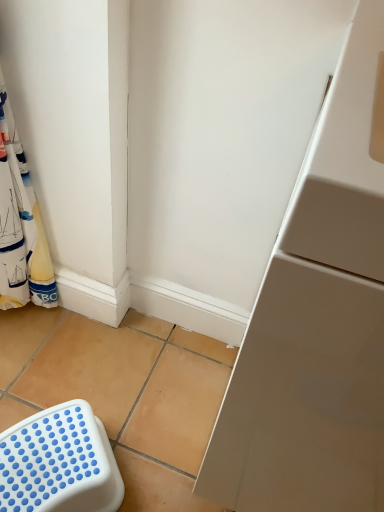
This screenshot has height=512, width=384. Describe the element at coordinates (59, 463) in the screenshot. I see `white plastic stool at lower left` at that location.

Where is `white plastic stool at lower left`? white plastic stool at lower left is located at coordinates (59, 463).

In order to face white fabric laundry at left, should I rotate leftwards or rightwards?

Turn left by 26.587 degrees to look at white fabric laundry at left.

Measure the distance between point (22, 207) and camera.

38.78 inches.

Where is `white fabric laundry at left`? Image resolution: width=384 pixels, height=512 pixels. white fabric laundry at left is located at coordinates (28, 211).

The image size is (384, 512). What do you see at coordinates (28, 211) in the screenshot? I see `white fabric laundry at left` at bounding box center [28, 211].

I want to click on white plastic stool at lower left, so click(x=59, y=463).

Is white fabric laundry at left to the right of white plastic stool at lower left from the viewer's perspective?

In fact, white fabric laundry at left is to the left of white plastic stool at lower left.

Which object is further away from the camera, white fabric laundry at left or white plastic stool at lower left?

white plastic stool at lower left.

Considering the positions of point (5, 122) and point (56, 488), is point (5, 122) closer or farther from the camera than point (56, 488)?

Point (5, 122) is farther from the camera than point (56, 488).

From the image's perspective, would you say white fabric laundry at left is shown under white plastic stool at lower left?

Actually, white fabric laundry at left appears above white plastic stool at lower left in the image.

From a real-world perspective, is white fabric laundry at left on white plastic stool at lower left?

Indeed, from a real-world perspective, white fabric laundry at left stands above white plastic stool at lower left.

Can you confirm if white fabric laundry at left is wider than white plastic stool at lower left?

No, white fabric laundry at left is not wider than white plastic stool at lower left.

Consider the image. Considering the relative sizes of white fabric laundry at left and white plastic stool at lower left in the image provided, is white fabric laundry at left taller than white plastic stool at lower left?

Indeed, white fabric laundry at left has a greater height compared to white plastic stool at lower left.

Who is smaller, white fabric laundry at left or white plastic stool at lower left?

white plastic stool at lower left.

Looking at this image, is white fabric laundry at left inside the boundaries of white plastic stool at lower left, or outside?

white fabric laundry at left exists outside the volume of white plastic stool at lower left.

Is white fabric laundry at left next to white plastic stool at lower left and touching it?

white fabric laundry at left is not next to white plastic stool at lower left, and they're not touching.

Is white fabric laundry at left turned away from white plastic stool at lower left?

No.

What's the angular difference between white fabric laundry at left and white plastic stool at lower left's facing directions?

The angular difference between white fabric laundry at left and white plastic stool at lower left is 28.2 degrees.

Measure the distance between white fabric laundry at left and white plastic stool at lower left.

They are 19.02 inches apart.

I want to click on furniture on the right of the white fabric laundry at left, so click(x=59, y=463).

Can you confirm if white plastic stool at lower left is positioned to the right of white fabric laundry at left?

Yes.

Considering the positions of objects white plastic stool at lower left and white fabric laundry at left in the image provided, who is in front, white plastic stool at lower left or white fabric laundry at left?

Result: white fabric laundry at left.

Which is closer to the camera, [30,467] or [0,74]?

The point [0,74] is more forward.

From the image's perspective, between white plastic stool at lower left and white fabric laundry at left, which one is located above?

white fabric laundry at left is shown above in the image.

From a real-world perspective, is white plastic stool at lower left on white fabric laundry at left?

No.

Considering the sizes of objects white plastic stool at lower left and white fabric laundry at left in the image provided, who is wider, white plastic stool at lower left or white fabric laundry at left?

white plastic stool at lower left.

Between white plastic stool at lower left and white fabric laundry at left, which one has less height?

With less height is white plastic stool at lower left.

Can you confirm if white plastic stool at lower left is smaller than white fabric laundry at left?

Indeed, white plastic stool at lower left has a smaller size compared to white fabric laundry at left.

Is white fabric laundry at left a part of white plastic stool at lower left?

No, white fabric laundry at left is not inside white plastic stool at lower left.

From the picture: Are white plastic stool at lower left and white fabric laundry at left far apart?

That's not correct — white plastic stool at lower left is a little close to white fabric laundry at left.

Is white plastic stool at lower left positioned with its back to white fabric laundry at left?

Yes, white plastic stool at lower left's orientation is away from white fabric laundry at left.

Looking at this image, what's the angular difference between white plastic stool at lower left and white fabric laundry at left's facing directions?

There is a 28.2-degree angle between the facing directions of white plastic stool at lower left and white fabric laundry at left.

Locate an element on the screen. The width and height of the screenshot is (384, 512). furniture behind the white fabric laundry at left is located at coordinates (59, 463).

This screenshot has height=512, width=384. I want to click on furniture below the white fabric laundry at left (from a real-world perspective), so click(59, 463).

This screenshot has height=512, width=384. What are the coordinates of `furniture below the white fabric laundry at left (from the image's perspective)` in the screenshot? It's located at (59, 463).